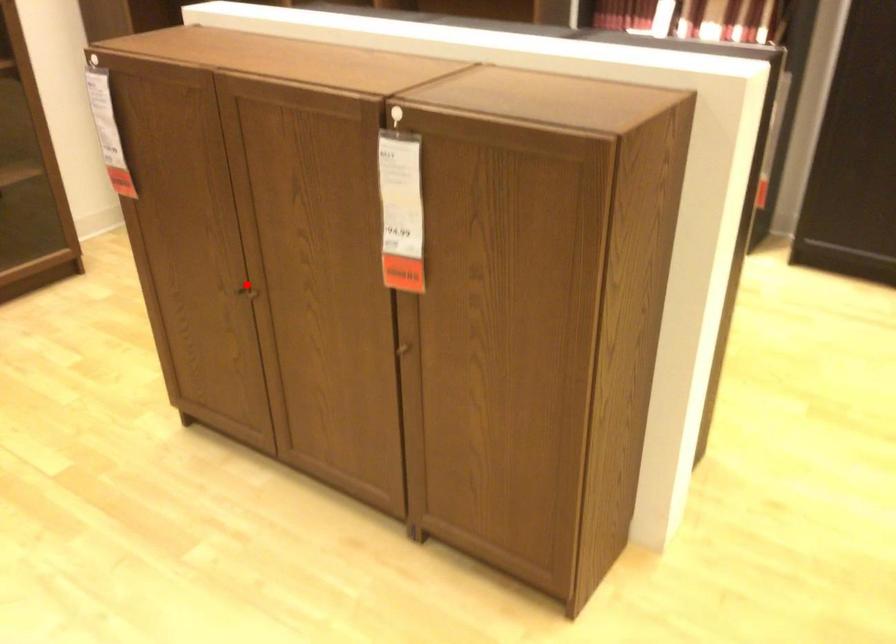
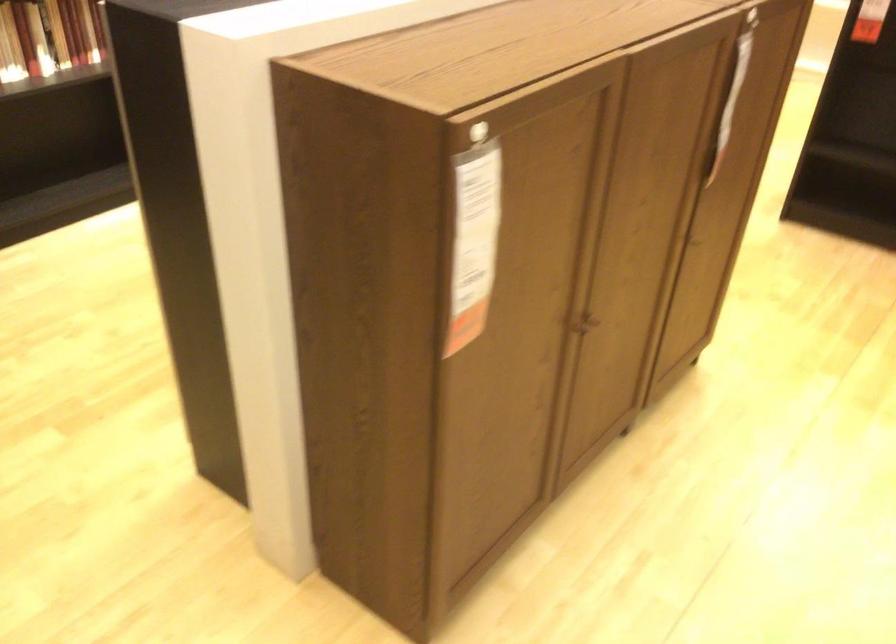
The point at the highlighted location is marked in the first image. Where is the corresponding point in the second image?

(583, 323)